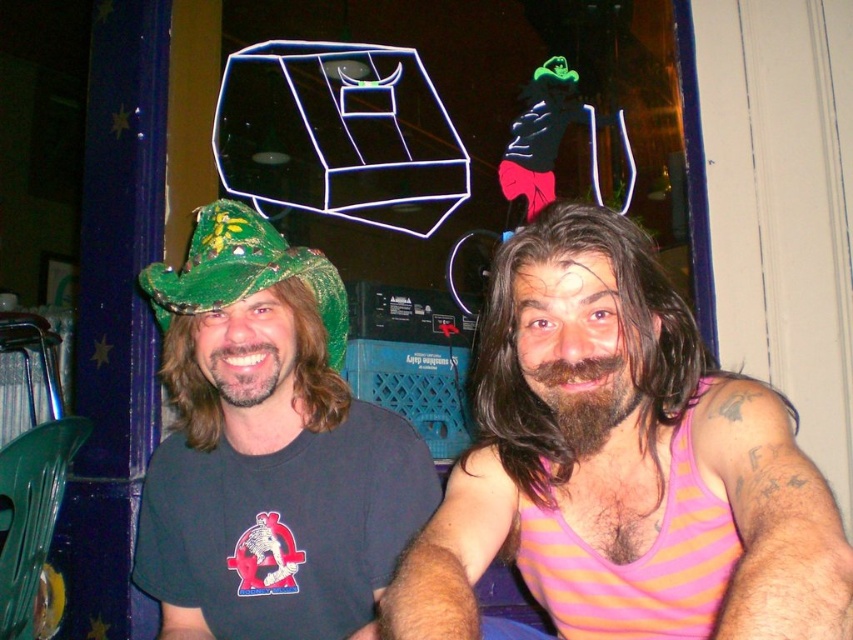
Question: Can you confirm if pink striped tank top at center is thinner than green glittery hat at left?

Choices:
 (A) no
 (B) yes

Answer: (A)

Question: Which of these objects is positioned farthest from the green sequined hat at upper left?

Choices:
 (A) pink striped tank top at center
 (B) green glittery hat at left

Answer: (A)

Question: Can you confirm if pink striped tank top at center is positioned to the right of green sequined hat at upper left?

Choices:
 (A) yes
 (B) no

Answer: (A)

Question: Which object is positioned farthest from the green glittery hat at left?

Choices:
 (A) green sequined hat at upper left
 (B) pink striped tank top at center

Answer: (B)

Question: Does pink striped tank top at center lie in front of green glittery hat at left?

Choices:
 (A) yes
 (B) no

Answer: (A)

Question: Which object appears farthest from the camera in this image?

Choices:
 (A) green sequined hat at upper left
 (B) pink striped tank top at center
 (C) green glittery hat at left

Answer: (A)